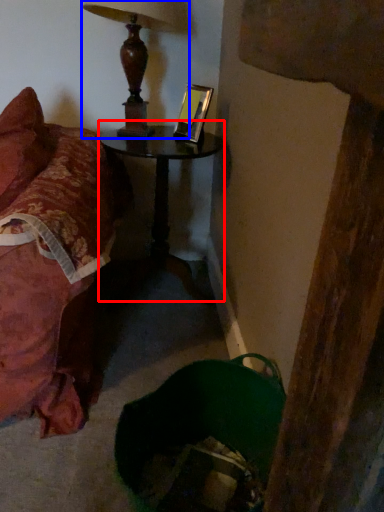
Question: Which object is further to the camera taking this photo, table (highlighted by a red box) or lamp (highlighted by a blue box)?

Choices:
 (A) table
 (B) lamp

Answer: (A)